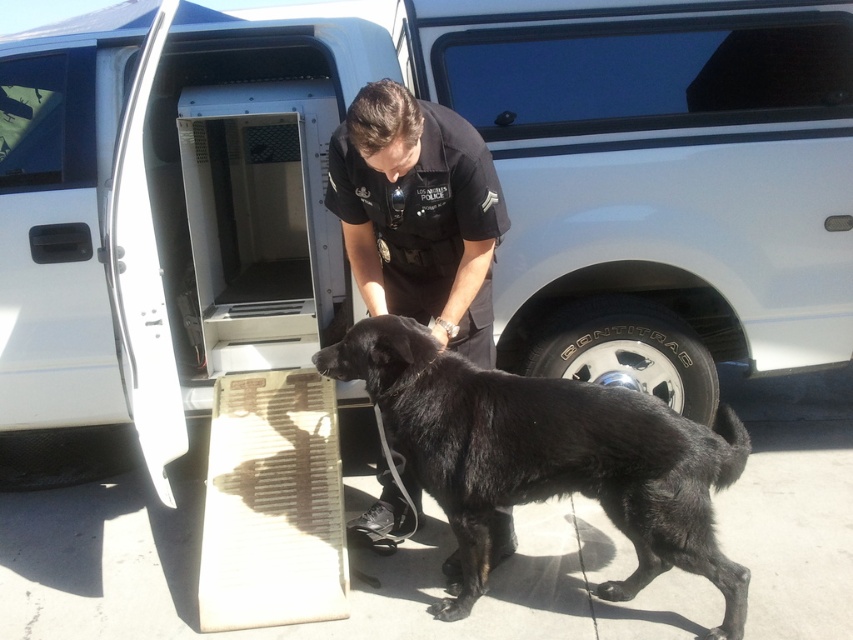
Who is taller, black fur dog at center or black uniformed officer at center?

Standing taller between the two is black fur dog at center.

What do you see at coordinates (548, 458) in the screenshot?
I see `black fur dog at center` at bounding box center [548, 458].

You are a GUI agent. You are given a task and a screenshot of the screen. Output one action in this format:
    pyautogui.click(x=<x>, y=<y>)
    Task: Click on the black fur dog at center
    Image resolution: width=853 pixels, height=640 pixels.
    Given the screenshot: What is the action you would take?
    pyautogui.click(x=548, y=458)